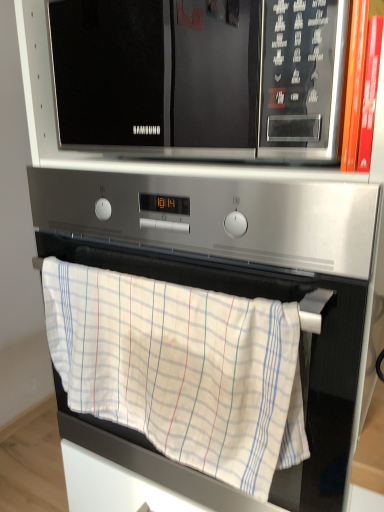
Question: Is satin silver oven at center far from black glossy microwave at upper center?

Choices:
 (A) no
 (B) yes

Answer: (A)

Question: Is satin silver oven at center smaller than black glossy microwave at upper center?

Choices:
 (A) no
 (B) yes

Answer: (A)

Question: Considering the relative sizes of satin silver oven at center and black glossy microwave at upper center in the image provided, is satin silver oven at center taller than black glossy microwave at upper center?

Choices:
 (A) yes
 (B) no

Answer: (A)

Question: Is the position of satin silver oven at center less distant than that of black glossy microwave at upper center?

Choices:
 (A) yes
 (B) no

Answer: (B)

Question: Is satin silver oven at center further to camera compared to black glossy microwave at upper center?

Choices:
 (A) no
 (B) yes

Answer: (B)

Question: From the image's perspective, is satin silver oven at center above black glossy microwave at upper center?

Choices:
 (A) no
 (B) yes

Answer: (A)

Question: From a real-world perspective, is black glossy microwave at upper center located beneath satin silver oven at center?

Choices:
 (A) no
 (B) yes

Answer: (A)

Question: Is black glossy microwave at upper center far away from satin silver oven at center?

Choices:
 (A) no
 (B) yes

Answer: (A)

Question: Is black glossy microwave at upper center positioned with its back to satin silver oven at center?

Choices:
 (A) no
 (B) yes

Answer: (A)

Question: Is satin silver oven at center surrounded by black glossy microwave at upper center?

Choices:
 (A) no
 (B) yes

Answer: (A)

Question: Is black glossy microwave at upper center bigger than satin silver oven at center?

Choices:
 (A) yes
 (B) no

Answer: (B)

Question: Is black glossy microwave at upper center positioned behind satin silver oven at center?

Choices:
 (A) no
 (B) yes

Answer: (A)

Question: From a real-world perspective, is black glossy microwave at upper center physically located above or below satin silver oven at center?

Choices:
 (A) above
 (B) below

Answer: (A)